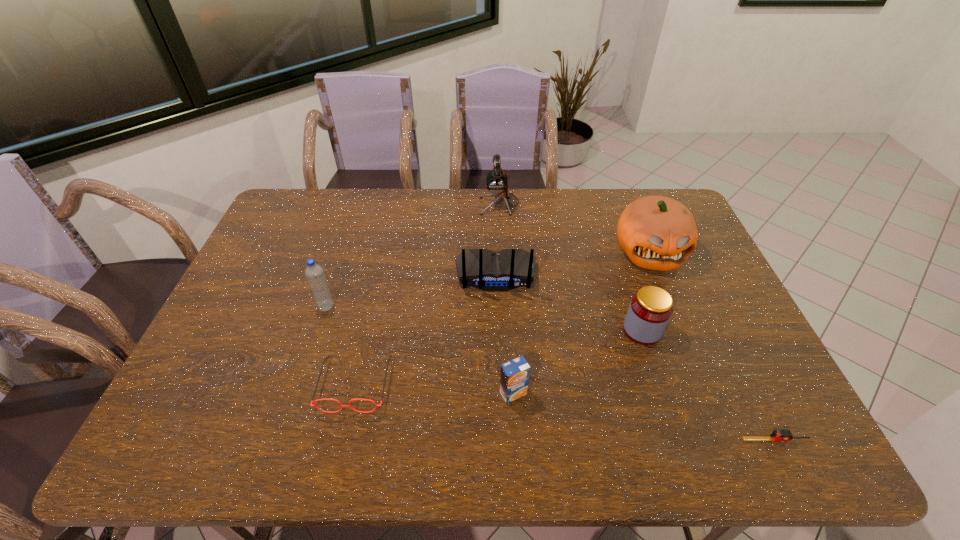
Find the location of a particular element. The height and width of the screenshot is (540, 960). vacant point located between the farthest object and the seventh object from right to left is located at coordinates (427, 294).

At what (x,y) coordinates should I click in order to perform the action: click on object that is the sixth closest to the orange_juice. Please return your answer as a coordinate pair (x, y). Looking at the image, I should click on (314, 273).

Locate which object is the third closest to the pumpkin. Please provide its 2D coordinates. Your answer should be formatted as a tuple, i.e. [(x, y)], where the tuple contains the x and y coordinates of a point satisfying the conditions above.

[(497, 183)]

Where is `free spot that satisfies the following two spatial constraints: 1. on the front-facing side of the orange_juice; 2. on the left side of the spectacles`? free spot that satisfies the following two spatial constraints: 1. on the front-facing side of the orange_juice; 2. on the left side of the spectacles is located at coordinates (353, 393).

The image size is (960, 540). Identify the location of vacant region that satisfies the following two spatial constraints: 1. on the back of the nearest object; 2. on the right side of the router. (501, 440).

Locate an element on the screen. The width and height of the screenshot is (960, 540). free spot that satisfies the following two spatial constraints: 1. on the front side of the tape measure; 2. on the right side of the orange_juice is located at coordinates (516, 440).